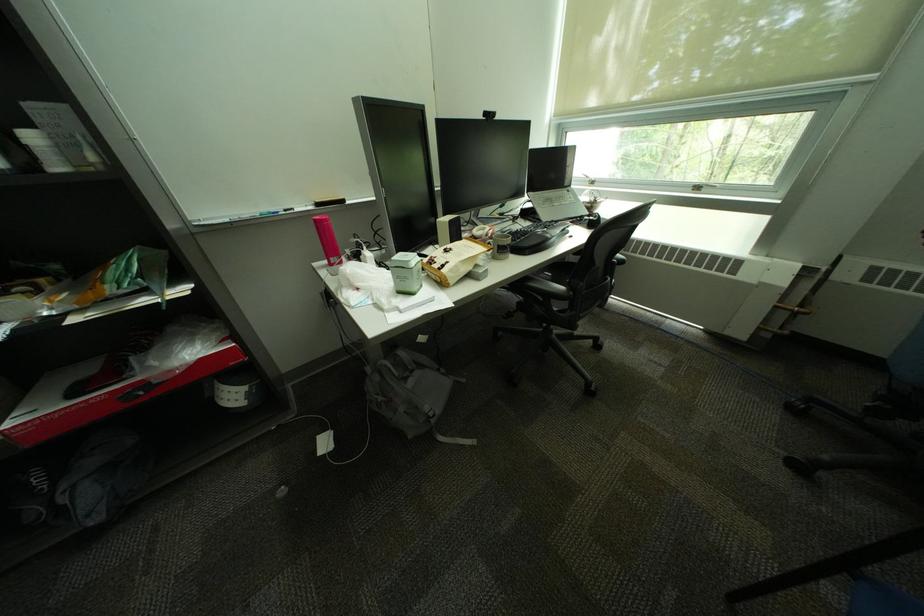
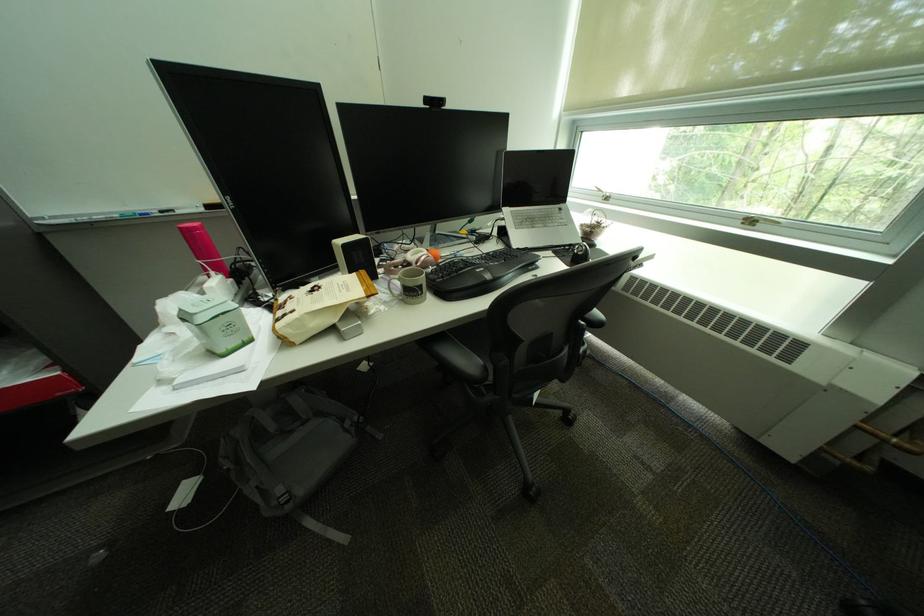
In the second image, find the point that corresponds to the point at 325,222 in the first image.

(190, 230)